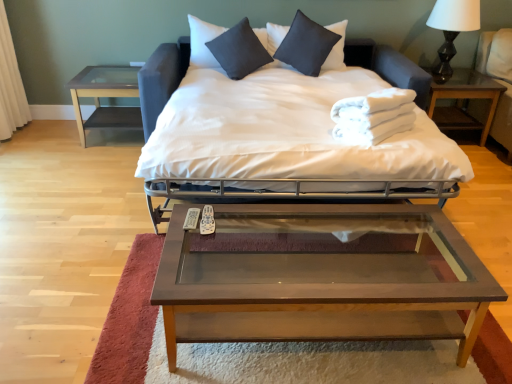
This screenshot has width=512, height=384. What do you see at coordinates (306, 45) in the screenshot? I see `dark gray satin pillow at upper center, the first pillow from the right` at bounding box center [306, 45].

In order to face dark gray satin pillow at upper center, arranged as the second pillow when viewed from the left, should I rotate leftwards or rightwards?

Turn right by 6.901 degrees to look at dark gray satin pillow at upper center, arranged as the second pillow when viewed from the left.

The image size is (512, 384). What do you see at coordinates (462, 99) in the screenshot? I see `white fabric towels at right, the second nightstand positioned from the left` at bounding box center [462, 99].

The height and width of the screenshot is (384, 512). Describe the element at coordinates (321, 280) in the screenshot. I see `brown wood/glass coffee table at center` at that location.

Measure the distance between white fabric bed at center and camera.

They are 1.90 meters apart.

What do you see at coordinates (10, 84) in the screenshot? I see `white fabric curtain at left` at bounding box center [10, 84].

At what (x,y) coordinates should I click in order to perform the action: click on dark gray satin pillow at upper center, arranged as the second pillow when viewed from the left. Please return your answer as a coordinate pair (x, y). This screenshot has width=512, height=384. Looking at the image, I should click on (306, 45).

Can you confirm if white fluffy towels at center is taller than white fabric towels at right, the first nightstand positioned from the right?

No, white fluffy towels at center is not taller than white fabric towels at right, the first nightstand positioned from the right.

Which is in front, point (343, 116) or point (450, 109)?

The point (343, 116) is more forward.

From a real-world perspective, between white fluffy towels at center and white fabric towels at right, the second nightstand positioned from the left, who is vertically higher?

white fluffy towels at center, from a real-world perspective.

Which of these two, white fluffy towels at center or dark gray linen pillow at center, the 2th pillow positioned from the right, stands taller?

dark gray linen pillow at center, the 2th pillow positioned from the right, is taller.

Who is more distant, white fluffy towels at center or dark gray linen pillow at center, the 2th pillow positioned from the right?

dark gray linen pillow at center, the 2th pillow positioned from the right, is further away from the camera.

Looking at this image, is white fluffy towels at center facing away from dark gray linen pillow at center, arranged as the 1th pillow when viewed from the left?

white fluffy towels at center does not have its back to dark gray linen pillow at center, arranged as the 1th pillow when viewed from the left.

From the image's perspective, would you say white fluffy towels at center is positioned over dark gray linen pillow at center, arranged as the 1th pillow when viewed from the left?

No, from the image's perspective, white fluffy towels at center is not above dark gray linen pillow at center, arranged as the 1th pillow when viewed from the left.

How far apart are white fluffy towels at center and white matte table lamp at upper right?

1.57 meters.

Would you say white fluffy towels at center is outside white matte table lamp at upper right?

Yes, white fluffy towels at center is outside of white matte table lamp at upper right.

Which is closer, (403,128) or (449,6)?

Positioned in front is point (403,128).

The height and width of the screenshot is (384, 512). Find the location of `material below the white matte table lamp at upper right (from the image's perspective)`. material below the white matte table lamp at upper right (from the image's perspective) is located at coordinates (373, 116).

Is dark gray linen pillow at center, the 2th pillow positioned from the right, completely or partially inside white fabric curtain at left?

No, dark gray linen pillow at center, the 2th pillow positioned from the right, is not inside white fabric curtain at left.

From the image's perspective, is white fabric curtain at left positioned above or below dark gray linen pillow at center, arranged as the 1th pillow when viewed from the left?

white fabric curtain at left is situated lower than dark gray linen pillow at center, arranged as the 1th pillow when viewed from the left, in the image.

Considering the positions of objects white fabric curtain at left and dark gray linen pillow at center, arranged as the 1th pillow when viewed from the left, in the image provided, who is more to the left, white fabric curtain at left or dark gray linen pillow at center, arranged as the 1th pillow when viewed from the left,?

white fabric curtain at left is more to the left.

Is white fabric towels at right, the first nightstand positioned from the right, positioned beyond the bounds of brown wood/glass coffee table at center?

Absolutely, white fabric towels at right, the first nightstand positioned from the right, is external to brown wood/glass coffee table at center.

Could you tell me if white fabric towels at right, the first nightstand positioned from the right, is facing brown wood/glass coffee table at center?

No.

Can you confirm if white fabric towels at right, the first nightstand positioned from the right, is taller than brown wood/glass coffee table at center?

Yes.

Considering the positions of objects dark gray linen pillow at center, the 2th pillow positioned from the right, and white fabric bed at center in the image provided, who is more to the right, dark gray linen pillow at center, the 2th pillow positioned from the right, or white fabric bed at center?

white fabric bed at center is more to the right.

There is a white fabric bed at center. Where is `the 1st pillow above it (from a real-world perspective)`? The image size is (512, 384). the 1st pillow above it (from a real-world perspective) is located at coordinates (239, 50).

Does point (246, 52) lie behind point (206, 76)?

Yes, it is behind point (206, 76).

Is white fabric bed at center facing towards white fabric curtain at left?

No.

Is white fabric bed at center smaller than white fabric curtain at left?

No, white fabric bed at center is not smaller than white fabric curtain at left.

Is white fabric bed at center wider than white fabric curtain at left?

Yes.

This screenshot has width=512, height=384. I want to click on material on the left of white fabric towels at right, the first nightstand positioned from the right, so click(373, 116).

The width and height of the screenshot is (512, 384). I want to click on material to the right of dark gray linen pillow at center, the 2th pillow positioned from the right, so click(x=373, y=116).

Considering their positions, is brown wood/glass coffee table at center positioned further to light brown wood armchair at right than white matte table lamp at upper right?

brown wood/glass coffee table at center.

Based on their spatial positions, is light brown wood armchair at right or clear glass table at left, acting as the first nightstand starting from the left, closer to white fabric bed at center?

Among the two, clear glass table at left, acting as the first nightstand starting from the left, is located nearer to white fabric bed at center.

Considering their positions, is dark gray linen pillow at center, arranged as the 1th pillow when viewed from the left, positioned closer to dark gray satin pillow at upper center, arranged as the second pillow when viewed from the left, than white fabric curtain at left?

Among the two, dark gray linen pillow at center, arranged as the 1th pillow when viewed from the left, is located nearer to dark gray satin pillow at upper center, arranged as the second pillow when viewed from the left.

Which object lies nearer to the anchor point white fluffy towels at center, brown wood/glass coffee table at center or white fabric curtain at left?

The object closer to white fluffy towels at center is brown wood/glass coffee table at center.

Considering their positions, is light brown wood armchair at right positioned further to white fabric bed at center than white fabric curtain at left?

white fabric curtain at left is positioned further to the anchor white fabric bed at center.

Considering their positions, is white matte table lamp at upper right positioned further to brown wood/glass coffee table at center than white fabric towels at right, the second nightstand positioned from the left?

Among the two, white matte table lamp at upper right is located further to brown wood/glass coffee table at center.

Estimate the real-world distances between objects in this image. Which object is further from white fabric towels at right, the first nightstand positioned from the right, brown wood/glass coffee table at center or clear glass table at left, acting as the first nightstand starting from the left?

clear glass table at left, acting as the first nightstand starting from the left, is positioned further to the anchor white fabric towels at right, the first nightstand positioned from the right.

Considering their positions, is clear glass table at left, which appears as the 2th nightstand when viewed from the right, positioned further to dark gray linen pillow at center, arranged as the 1th pillow when viewed from the left, than white fluffy towels at center?

white fluffy towels at center lies further to dark gray linen pillow at center, arranged as the 1th pillow when viewed from the left, than the other object.

The height and width of the screenshot is (384, 512). In order to click on material between white fabric bed at center and dark gray linen pillow at center, the 2th pillow positioned from the right, along the z-axis in this screenshot , I will do `click(373, 116)`.

You are a GUI agent. You are given a task and a screenshot of the screen. Output one action in this format:
    pyautogui.click(x=<x>, y=<y>)
    Task: Click on the pillow between white fabric curtain at left and dark gray satin pillow at upper center, the first pillow from the right, from left to right
    
    Given the screenshot: What is the action you would take?
    pyautogui.click(x=239, y=50)

Find the location of a particular element. The width and height of the screenshot is (512, 384). material between white fabric bed at center and white matte table lamp at upper right from front to back is located at coordinates (373, 116).

Locate an element on the screen. The width and height of the screenshot is (512, 384). material between brown wood/glass coffee table at center and dark gray satin pillow at upper center, the first pillow from the right, in the front-back direction is located at coordinates (373, 116).